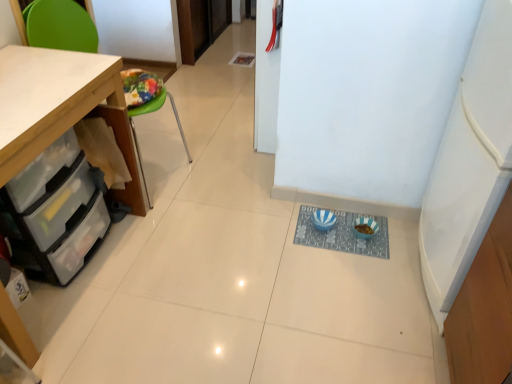
Question: Are clear plastic drawers at lower left and wooden cabinet at left located far from each other?

Choices:
 (A) yes
 (B) no

Answer: (B)

Question: Does clear plastic drawers at lower left have a greater height compared to wooden cabinet at left?

Choices:
 (A) no
 (B) yes

Answer: (A)

Question: Is clear plastic drawers at lower left positioned with its back to wooden cabinet at left?

Choices:
 (A) yes
 (B) no

Answer: (A)

Question: Does clear plastic drawers at lower left come in front of wooden cabinet at left?

Choices:
 (A) no
 (B) yes

Answer: (A)

Question: Can you confirm if clear plastic drawers at lower left is positioned to the left of wooden cabinet at left?

Choices:
 (A) no
 (B) yes

Answer: (B)

Question: Which is correct: blue striped bowls at center is inside clear plastic drawers at lower left, or outside of it?

Choices:
 (A) inside
 (B) outside

Answer: (B)

Question: Is blue striped bowls at center taller or shorter than clear plastic drawers at lower left?

Choices:
 (A) tall
 (B) short

Answer: (B)

Question: Considering the positions of blue striped bowls at center and clear plastic drawers at lower left in the image, is blue striped bowls at center wider or thinner than clear plastic drawers at lower left?

Choices:
 (A) thin
 (B) wide

Answer: (A)

Question: From the image's perspective, is blue striped bowls at center positioned above or below clear plastic drawers at lower left?

Choices:
 (A) below
 (B) above

Answer: (A)

Question: From the image's perspective, is blue striped bowls at center located above or below wooden cabinet at left?

Choices:
 (A) below
 (B) above

Answer: (A)

Question: From a real-world perspective, is blue striped bowls at center above or below wooden cabinet at left?

Choices:
 (A) below
 (B) above

Answer: (A)

Question: Is blue striped bowls at center wider or thinner than wooden cabinet at left?

Choices:
 (A) wide
 (B) thin

Answer: (B)

Question: Is blue striped bowls at center to the left or to the right of wooden cabinet at left in the image?

Choices:
 (A) right
 (B) left

Answer: (A)

Question: Is clear plastic drawers at lower left spatially inside blue striped bowls at center, or outside of it?

Choices:
 (A) inside
 (B) outside

Answer: (B)

Question: Considering the positions of point (100, 196) and point (349, 221), is point (100, 196) closer or farther from the camera than point (349, 221)?

Choices:
 (A) closer
 (B) farther

Answer: (A)